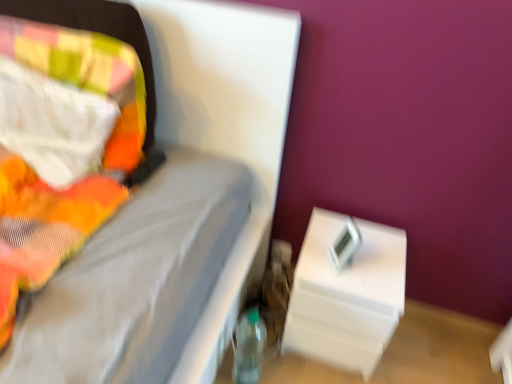
Question: Looking at their shapes, would you say white plastic nightstand at lower right is wider or thinner than fluffy multicolored pillow at left?

Choices:
 (A) wide
 (B) thin

Answer: (A)

Question: From the image's perspective, is white plastic nightstand at lower right positioned above or below fluffy multicolored pillow at left?

Choices:
 (A) below
 (B) above

Answer: (A)

Question: Estimate the real-world distances between objects in this image. Which object is closer to the white plastic nightstand at lower right?

Choices:
 (A) transparent plastic bottle at lower center
 (B) fluffy multicolored pillow at left

Answer: (A)

Question: Which object is the closest to the white plastic nightstand at lower right?

Choices:
 (A) transparent plastic bottle at lower center
 (B) fluffy multicolored pillow at left

Answer: (A)